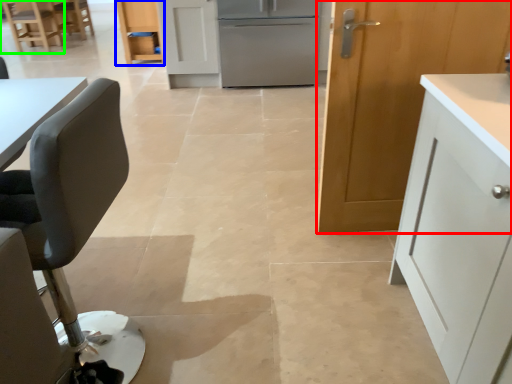
Question: Considering the real-world distances, which object is farthest from cabinetry (highlighted by a red box)? cabinetry (highlighted by a blue box) or chair (highlighted by a green box)?

Choices:
 (A) cabinetry
 (B) chair

Answer: (B)